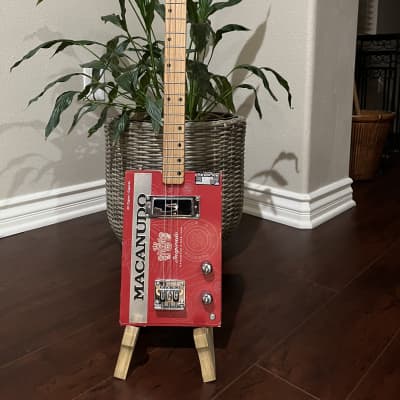
The image size is (400, 400). In order to click on basket in this screenshot , I will do [x=121, y=156].